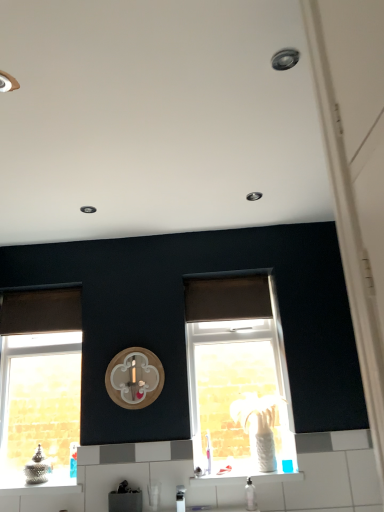
Question: Is brown matte curtain at center, the first curtain positioned from the right, thinner than wooden clock at center?

Choices:
 (A) yes
 (B) no

Answer: (B)

Question: Considering the relative sizes of brown matte curtain at center, the first curtain positioned from the right, and wooden clock at center in the image provided, is brown matte curtain at center, the first curtain positioned from the right, wider than wooden clock at center?

Choices:
 (A) yes
 (B) no

Answer: (A)

Question: From the image's perspective, is brown matte curtain at center, the first curtain positioned from the right, located above wooden clock at center?

Choices:
 (A) yes
 (B) no

Answer: (A)

Question: Is brown matte curtain at center, the 2th curtain from the left, turned away from wooden clock at center?

Choices:
 (A) no
 (B) yes

Answer: (A)

Question: Does brown matte curtain at center, the 2th curtain from the left, lie in front of wooden clock at center?

Choices:
 (A) no
 (B) yes

Answer: (A)

Question: Is brown matte curtain at center, the first curtain positioned from the right, with wooden clock at center?

Choices:
 (A) yes
 (B) no

Answer: (B)

Question: From a real-world perspective, is brown fabric curtain at left, the first curtain viewed from the left, on brown matte curtain at center, the 2th curtain from the left?

Choices:
 (A) yes
 (B) no

Answer: (A)

Question: Is brown fabric curtain at left, the second curtain from the right, positioned in front of brown matte curtain at center, the first curtain positioned from the right?

Choices:
 (A) no
 (B) yes

Answer: (A)

Question: Is brown fabric curtain at left, the first curtain viewed from the left, taller than brown matte curtain at center, the first curtain positioned from the right?

Choices:
 (A) no
 (B) yes

Answer: (A)

Question: From the image's perspective, is brown fabric curtain at left, the first curtain viewed from the left, located above brown matte curtain at center, the 2th curtain from the left?

Choices:
 (A) no
 (B) yes

Answer: (A)

Question: Does brown fabric curtain at left, the second curtain from the right, appear on the left side of brown matte curtain at center, the first curtain positioned from the right?

Choices:
 (A) yes
 (B) no

Answer: (A)

Question: Are brown fabric curtain at left, the first curtain viewed from the left, and brown matte curtain at center, the first curtain positioned from the right, far apart?

Choices:
 (A) yes
 (B) no

Answer: (B)

Question: Is clear glass window at left, the 2th window when ordered from right to left, located outside satin silver faucet at lower center?

Choices:
 (A) no
 (B) yes

Answer: (B)